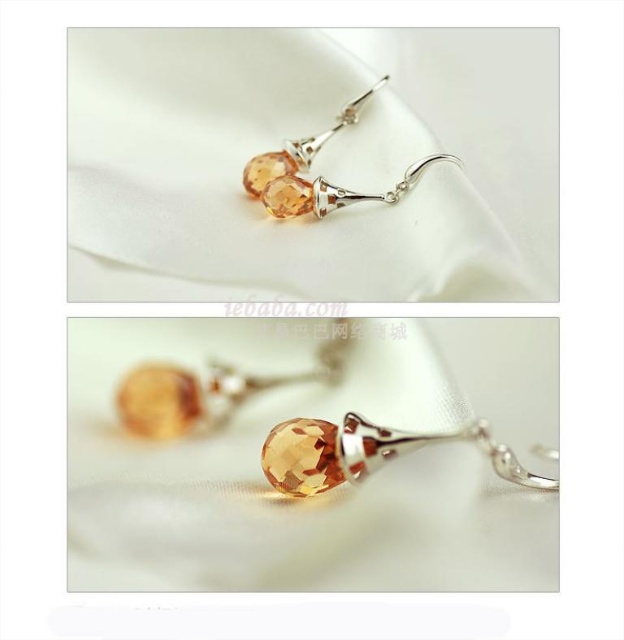
In the scene shown: Does citrine crystal drop at center have a greater width compared to citrine glass drop at center?

Correct, the width of citrine crystal drop at center exceeds that of citrine glass drop at center.

Is citrine crystal drop at center thinner than citrine glass drop at center?

No.

Image resolution: width=624 pixels, height=640 pixels. What do you see at coordinates (366, 452) in the screenshot?
I see `citrine crystal drop at center` at bounding box center [366, 452].

You are a GUI agent. You are given a task and a screenshot of the screen. Output one action in this format:
    pyautogui.click(x=<x>, y=<y>)
    Task: Click on the citrine crystal drop at center
    The width and height of the screenshot is (624, 640).
    Given the screenshot: What is the action you would take?
    pyautogui.click(x=366, y=452)